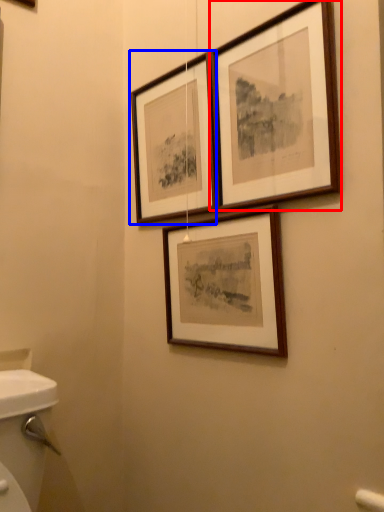
Question: Among these objects, which one is nearest to the camera, picture frame (highlighted by a red box) or picture frame (highlighted by a blue box)?

Choices:
 (A) picture frame
 (B) picture frame

Answer: (A)